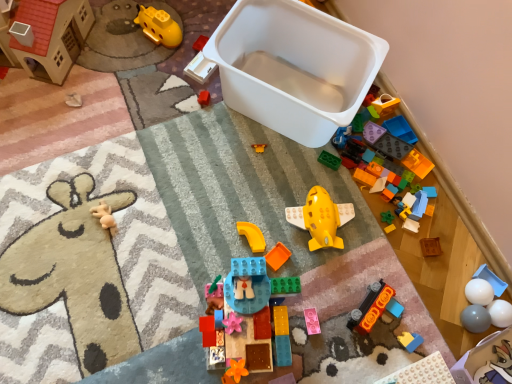
Locate an element on the screen. The image size is (512, 384). free spot to the right of yellow matte airplane at center, the 8th toy from the left is located at coordinates (371, 246).